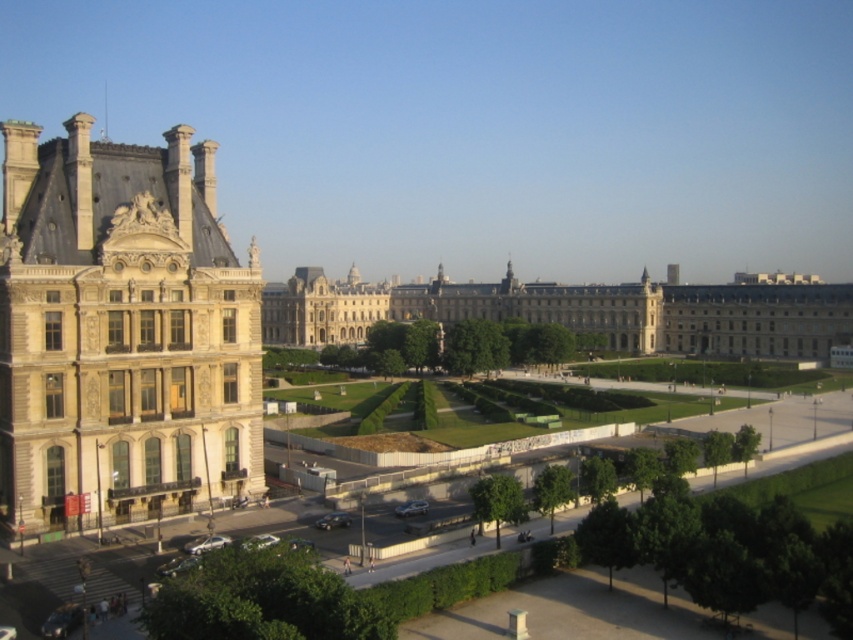
Question: Is beige stone palace at left above light beige stone building at center?

Choices:
 (A) no
 (B) yes

Answer: (A)

Question: Which object is farther from the camera taking this photo?

Choices:
 (A) light beige stone building at center
 (B) beige stone palace at left

Answer: (A)

Question: Where is beige stone palace at left located in relation to light beige stone building at center in the image?

Choices:
 (A) below
 (B) above

Answer: (A)

Question: Which point is farther to the camera?

Choices:
 (A) [703, 289]
 (B) [77, 385]

Answer: (A)

Question: Which point is closer to the camera?

Choices:
 (A) (33, 448)
 (B) (480, 314)

Answer: (A)

Question: Does beige stone palace at left appear under light beige stone building at center?

Choices:
 (A) yes
 (B) no

Answer: (A)